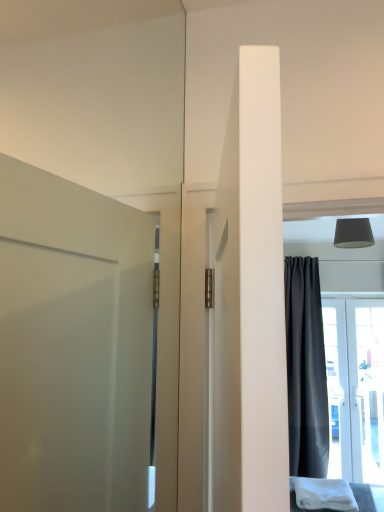
The image size is (384, 512). What do you see at coordinates (324, 494) in the screenshot?
I see `white soft cloth at lower right` at bounding box center [324, 494].

The height and width of the screenshot is (512, 384). I want to click on white soft cloth at lower right, so click(x=324, y=494).

Is white glossy door at right positioned with its back to matte gray lampshade at upper right?

white glossy door at right is not turned away from matte gray lampshade at upper right.

From the image's perspective, which object appears higher, white glossy door at right or matte gray lampshade at upper right?

matte gray lampshade at upper right is shown above in the image.

Is white glossy door at right at the right side of matte gray lampshade at upper right?

Yes.

How distant is white glossy door at right from matte gray lampshade at upper right?

white glossy door at right and matte gray lampshade at upper right are 6.87 feet apart.

How much distance is there between dark gray matte curtain at right and white glossy door at right?

The distance of dark gray matte curtain at right from white glossy door at right is 12.67 inches.

Is dark gray matte curtain at right at the right side of white glossy door at right?

In fact, dark gray matte curtain at right is to the left of white glossy door at right.

From the picture: Considering the relative sizes of dark gray matte curtain at right and white glossy door at right in the image provided, is dark gray matte curtain at right smaller than white glossy door at right?

No, dark gray matte curtain at right is not smaller than white glossy door at right.

Is dark gray matte curtain at right outside of white glossy door at right?

Yes, dark gray matte curtain at right is not within white glossy door at right.

In the image, there is a dark gray matte curtain at right. Where is `cloth below it (from a real-world perspective)`? This screenshot has width=384, height=512. cloth below it (from a real-world perspective) is located at coordinates (324, 494).

Which is behind, point (307, 256) or point (297, 495)?

The point (307, 256) is farther from the camera.

From a real-world perspective, is dark gray matte curtain at right on white soft cloth at lower right?

Yes, from a real-world perspective, dark gray matte curtain at right is above white soft cloth at lower right.

In the scene shown: From a real-world perspective, which object rests below the other?

white glossy door at right is physically lower.

I want to click on curtain on the left of the white glossy door at right, so [x=306, y=369].

Is white glossy door at right turned away from dark gray matte curtain at right?

No, white glossy door at right is not facing away from dark gray matte curtain at right.

From the image's perspective, which one is positioned lower, white glossy door at right or dark gray matte curtain at right?

white glossy door at right appears lower in the image.

Does white soft cloth at lower right have a larger size compared to white glossy door at right?

No, white soft cloth at lower right is not bigger than white glossy door at right.

From the image's perspective, which one is positioned lower, white soft cloth at lower right or white glossy door at right?

white soft cloth at lower right appears lower in the image.

Does point (330, 484) come behind point (360, 443)?

No, (330, 484) is in front of (360, 443).

In terms of height, does white soft cloth at lower right look taller or shorter compared to white glossy door at right?

Considering their sizes, white soft cloth at lower right has less height than white glossy door at right.

Can you see matte gray lampshade at upper right touching dark gray matte curtain at right?

matte gray lampshade at upper right is not next to dark gray matte curtain at right, and they're not touching.

Consider the image. Would you say dark gray matte curtain at right is part of matte gray lampshade at upper right's contents?

No, dark gray matte curtain at right is not surrounded by matte gray lampshade at upper right.

Can you tell me how much matte gray lampshade at upper right and dark gray matte curtain at right differ in facing direction?

There is a 0.103-degree angle between the facing directions of matte gray lampshade at upper right and dark gray matte curtain at right.

Considering the relative positions of matte gray lampshade at upper right and dark gray matte curtain at right in the image provided, is matte gray lampshade at upper right to the left of dark gray matte curtain at right from the viewer's perspective?

Yes, matte gray lampshade at upper right is to the left of dark gray matte curtain at right.

Between dark gray matte curtain at right and matte gray lampshade at upper right, which one is positioned behind?

dark gray matte curtain at right is further away from the camera.

Is dark gray matte curtain at right situated inside matte gray lampshade at upper right or outside?

dark gray matte curtain at right lies outside matte gray lampshade at upper right.

From the image's perspective, which is below, dark gray matte curtain at right or matte gray lampshade at upper right?

dark gray matte curtain at right, from the image's perspective.

Identify the location of lamp located on the left of white glossy door at right. (353, 233).

Where is `curtain above the white glossy door at right (from a real-world perspective)`? The width and height of the screenshot is (384, 512). curtain above the white glossy door at right (from a real-world perspective) is located at coordinates (306, 369).

Based on their spatial positions, is white glossy door at right or matte gray lampshade at upper right further from dark gray matte curtain at right?

matte gray lampshade at upper right lies further to dark gray matte curtain at right than the other object.

Looking at the image, which one is located closer to dark gray matte curtain at right, white soft cloth at lower right or matte gray lampshade at upper right?

white soft cloth at lower right is closer to dark gray matte curtain at right.

Based on the photo, from the image, which object appears to be farther from white glossy door at right, white soft cloth at lower right or dark gray matte curtain at right?

white soft cloth at lower right lies further to white glossy door at right than the other object.

Based on the photo, when comparing their distances from matte gray lampshade at upper right, does white soft cloth at lower right or white glossy door at right seem closer?

The object closer to matte gray lampshade at upper right is white soft cloth at lower right.

Consider the image. When comparing their distances from dark gray matte curtain at right, does matte gray lampshade at upper right or white glossy door at right seem further?

matte gray lampshade at upper right.

Estimate the real-world distances between objects in this image. Which object is closer to white glossy door at right, white soft cloth at lower right or matte gray lampshade at upper right?

Based on the image, white soft cloth at lower right appears to be nearer to white glossy door at right.

Considering their positions, is matte gray lampshade at upper right positioned closer to white soft cloth at lower right than dark gray matte curtain at right?

dark gray matte curtain at right lies closer to white soft cloth at lower right than the other object.

Based on their spatial positions, is matte gray lampshade at upper right or dark gray matte curtain at right further from white glossy door at right?

matte gray lampshade at upper right is positioned further to the anchor white glossy door at right.

Locate an element on the screen. The height and width of the screenshot is (512, 384). curtain between matte gray lampshade at upper right and white glossy door at right in the front-back direction is located at coordinates (306, 369).

Where is `curtain between matte gray lampshade at upper right and white soft cloth at lower right vertically`? This screenshot has width=384, height=512. curtain between matte gray lampshade at upper right and white soft cloth at lower right vertically is located at coordinates (306, 369).

This screenshot has width=384, height=512. Identify the location of door between matte gray lampshade at upper right and white soft cloth at lower right in the vertical direction. (355, 387).

Find the location of a particular element. The image size is (384, 512). curtain located between white soft cloth at lower right and white glossy door at right in the depth direction is located at coordinates [x=306, y=369].